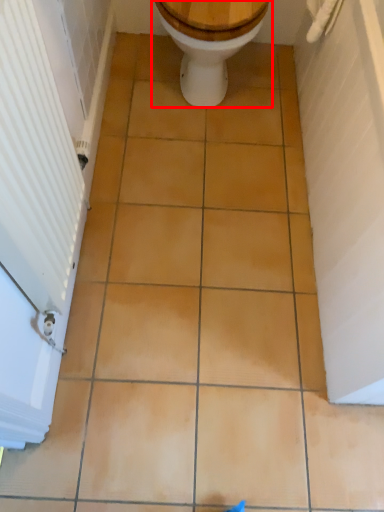
Question: From the image, what is the correct spatial relationship of toilet (annotated by the red box) in relation to screen door?

Choices:
 (A) right
 (B) left

Answer: (A)